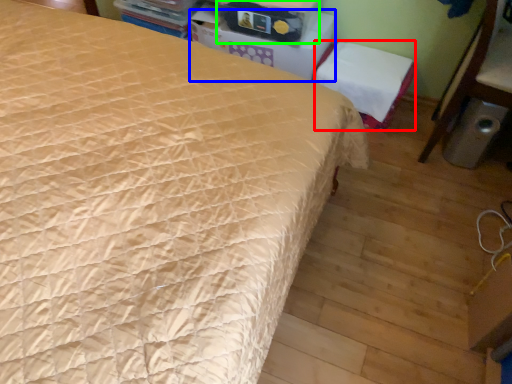
Question: Estimate the real-world distances between objects in this image. Which object is farther from chair (highlighted by a red box), table (highlighted by a blue box) or storage box (highlighted by a green box)?

Choices:
 (A) table
 (B) storage box

Answer: (B)